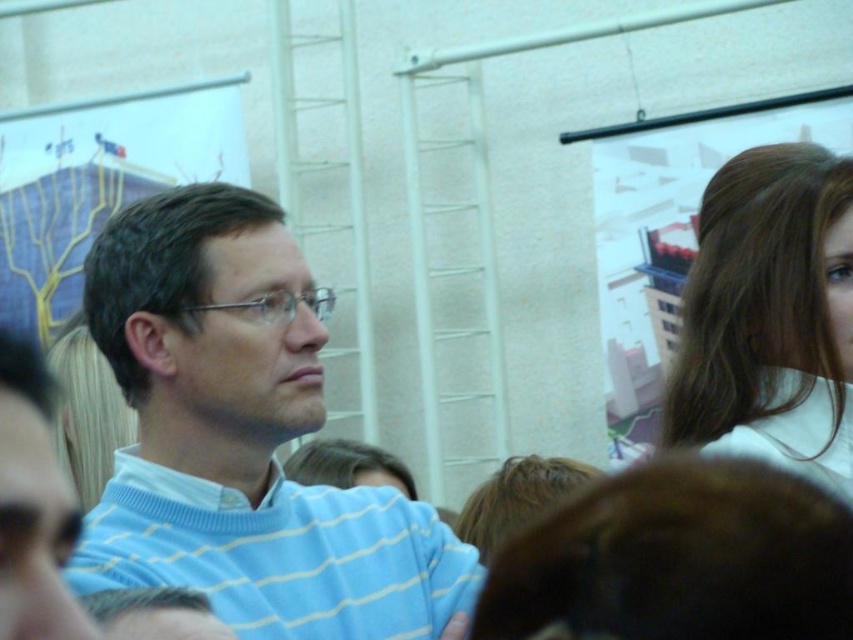
Who is positioned more to the right, light blue striped sweater at center or brown hair at upper right?

Positioned to the right is brown hair at upper right.

Describe the element at coordinates (242, 436) in the screenshot. This screenshot has width=853, height=640. I see `light blue striped sweater at center` at that location.

Locate an element on the screen. Image resolution: width=853 pixels, height=640 pixels. light blue striped sweater at center is located at coordinates (242, 436).